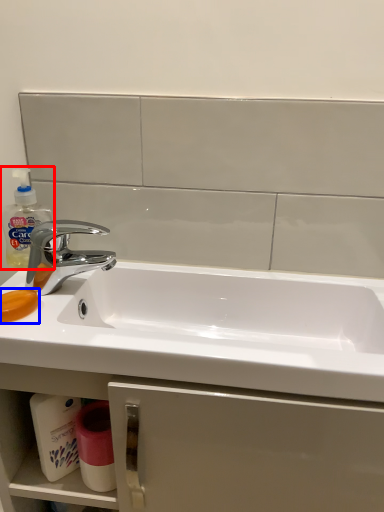
Question: Which object appears farthest to the camera in this image, cleaning product (highlighted by a red box) or soap (highlighted by a blue box)?

Choices:
 (A) cleaning product
 (B) soap

Answer: (A)